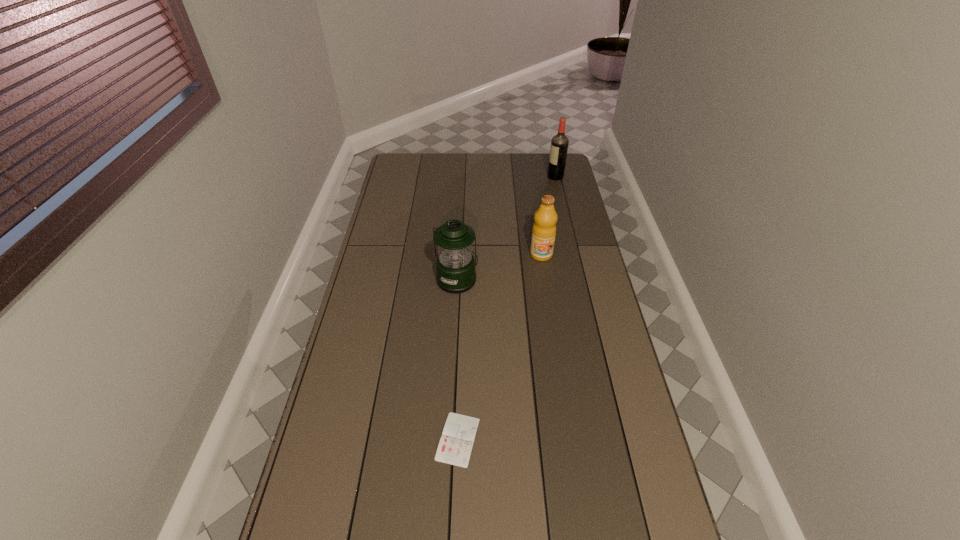
Image resolution: width=960 pixels, height=540 pixels. In order to click on free space at the far left corner of the desktop in this screenshot , I will do `click(420, 158)`.

Where is `blank space at the far right corner of the desktop`? The width and height of the screenshot is (960, 540). blank space at the far right corner of the desktop is located at coordinates (545, 158).

Image resolution: width=960 pixels, height=540 pixels. I want to click on free area in between the lantern and the liquor, so click(507, 228).

Identify the location of free space between the second farthest object and the nearest object. (499, 347).

Identify the location of free point between the second nearest object and the farthest object. (507, 228).

Find the location of a particular element. unoccupied area between the third nearest object and the nearest object is located at coordinates (499, 347).

I want to click on vacant area that lies between the farthest object and the lantern, so (507, 228).

In order to click on vacant area that lies between the third nearest object and the nearest object in this screenshot , I will do `click(499, 347)`.

Where is `empty space that is in between the second nearest object and the liquor`? The width and height of the screenshot is (960, 540). empty space that is in between the second nearest object and the liquor is located at coordinates pos(507,228).

Locate which object ranks third in proximity to the nearest object. Please provide its 2D coordinates. Your answer should be formatted as a tuple, i.e. [(x, y)], where the tuple contains the x and y coordinates of a point satisfying the conditions above.

[(559, 144)]